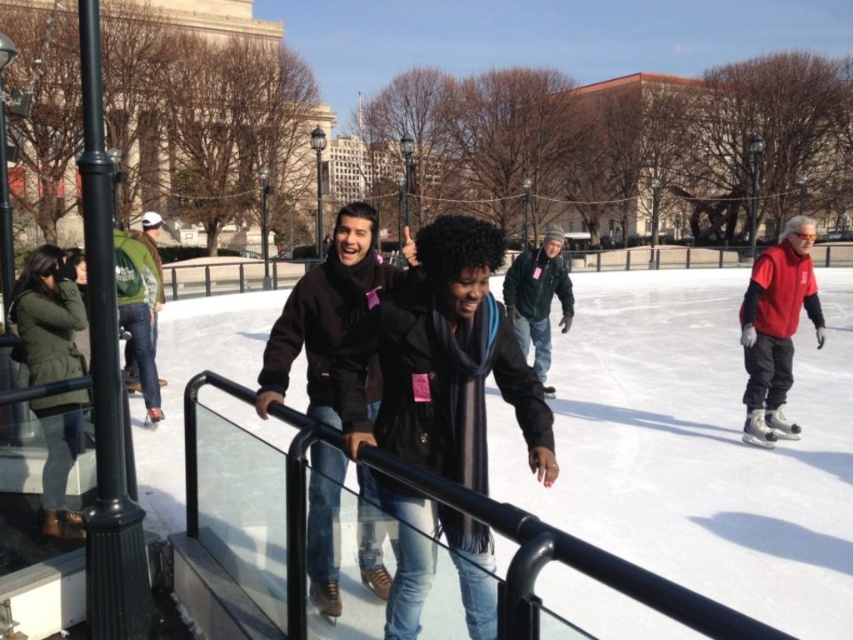
Question: Can you confirm if green woolen jacket at center is positioned above green fabric backpack at upper left?

Choices:
 (A) no
 (B) yes

Answer: (A)

Question: Which is nearer to the red fleece jacket at right?

Choices:
 (A) black glossy rail at center
 (B) green fabric backpack at upper left
 (C) green fuzzy coat at left
 (D) green woolen jacket at center

Answer: (D)

Question: Which object is the closest to the green fabric backpack at upper left?

Choices:
 (A) black matte jacket at center
 (B) green woolen jacket at center

Answer: (B)

Question: Which of the following is the farthest from the observer?

Choices:
 (A) (149, 230)
 (B) (434, 512)
 (C) (57, 394)

Answer: (A)

Question: Is green woolen jacket at center closer to the viewer compared to green fabric backpack at upper left?

Choices:
 (A) no
 (B) yes

Answer: (B)

Question: Is green woolen jacket at center to the right of green fabric backpack at upper left from the viewer's perspective?

Choices:
 (A) yes
 (B) no

Answer: (A)